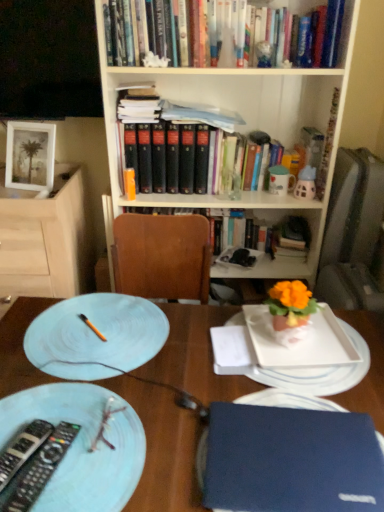
At what (x,y) coordinates should I click in order to perform the action: click on free space to the back side of blue hardcover book at lower right. Please return your answer as a coordinate pair (x, y). This screenshot has height=512, width=384. Looking at the image, I should click on (264, 378).